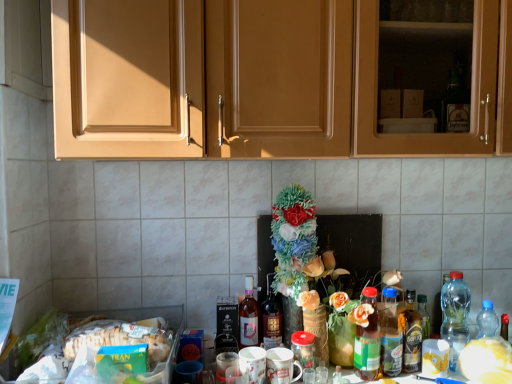
Question: Does green glass bottle at center, the fourth bottle from the right, have a greater height compared to green matte box of tran at lower left?

Choices:
 (A) yes
 (B) no

Answer: (A)

Question: Considering the relative sizes of green glass bottle at center, the 3th bottle when ordered from left to right, and green matte box of tran at lower left in the image provided, is green glass bottle at center, the 3th bottle when ordered from left to right, thinner than green matte box of tran at lower left?

Choices:
 (A) yes
 (B) no

Answer: (A)

Question: Can you confirm if green glass bottle at center, the 3th bottle when ordered from left to right, is bigger than green matte box of tran at lower left?

Choices:
 (A) yes
 (B) no

Answer: (B)

Question: From a real-world perspective, does green glass bottle at center, the 3th bottle when ordered from left to right, stand above green matte box of tran at lower left?

Choices:
 (A) yes
 (B) no

Answer: (B)

Question: Is green glass bottle at center, the 3th bottle when ordered from left to right, far away from green matte box of tran at lower left?

Choices:
 (A) yes
 (B) no

Answer: (B)

Question: From a real-world perspective, is white matte flower at center positioned above or below green matte box of tran at lower left?

Choices:
 (A) below
 (B) above

Answer: (A)

Question: Is white matte flower at center taller or shorter than green matte box of tran at lower left?

Choices:
 (A) tall
 (B) short

Answer: (A)

Question: Visually, is white matte flower at center positioned to the left or to the right of green matte box of tran at lower left?

Choices:
 (A) right
 (B) left

Answer: (A)

Question: Is point (502, 355) closer or farther from the camera than point (117, 324)?

Choices:
 (A) closer
 (B) farther

Answer: (A)

Question: Looking at their shapes, would you say transparent plastic bottle at right, positioned as the 1th bottle in right-to-left order, is wider or thinner than matte wood cabinets at upper center?

Choices:
 (A) wide
 (B) thin

Answer: (B)

Question: Visually, is transparent plastic bottle at right, the sixth bottle positioned from the left, positioned to the left or to the right of matte wood cabinets at upper center?

Choices:
 (A) left
 (B) right

Answer: (B)

Question: In terms of height, does transparent plastic bottle at right, positioned as the 1th bottle in right-to-left order, look taller or shorter compared to matte wood cabinets at upper center?

Choices:
 (A) short
 (B) tall

Answer: (A)

Question: From a real-world perspective, is transparent plastic bottle at right, the sixth bottle positioned from the left, above or below matte wood cabinets at upper center?

Choices:
 (A) below
 (B) above

Answer: (A)

Question: Does point (407, 314) appear closer or farther from the camera than point (309, 344)?

Choices:
 (A) closer
 (B) farther

Answer: (B)

Question: Visually, is translucent glass bottle at center right, the fifth bottle viewed from the left, positioned to the left or to the right of translucent glass jar at center?

Choices:
 (A) left
 (B) right

Answer: (B)